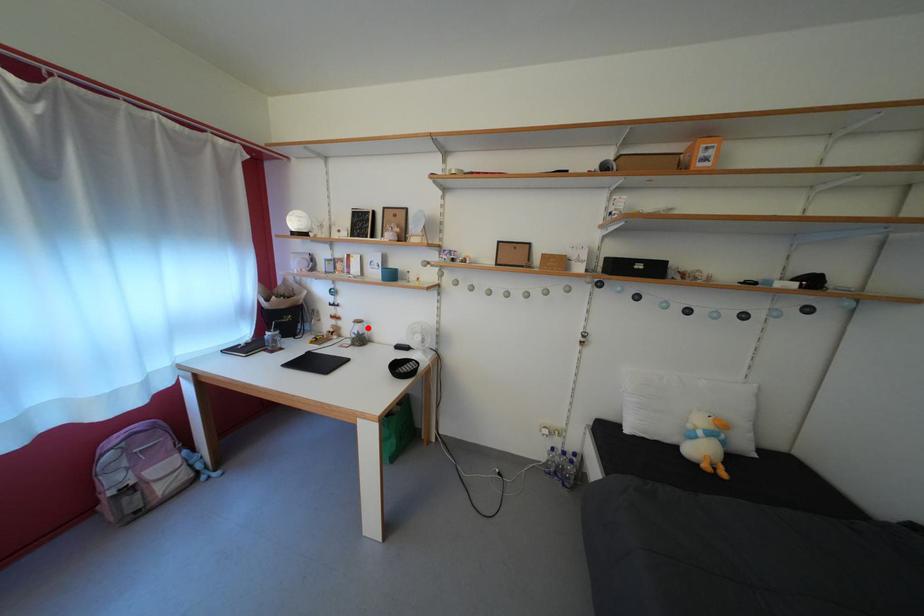
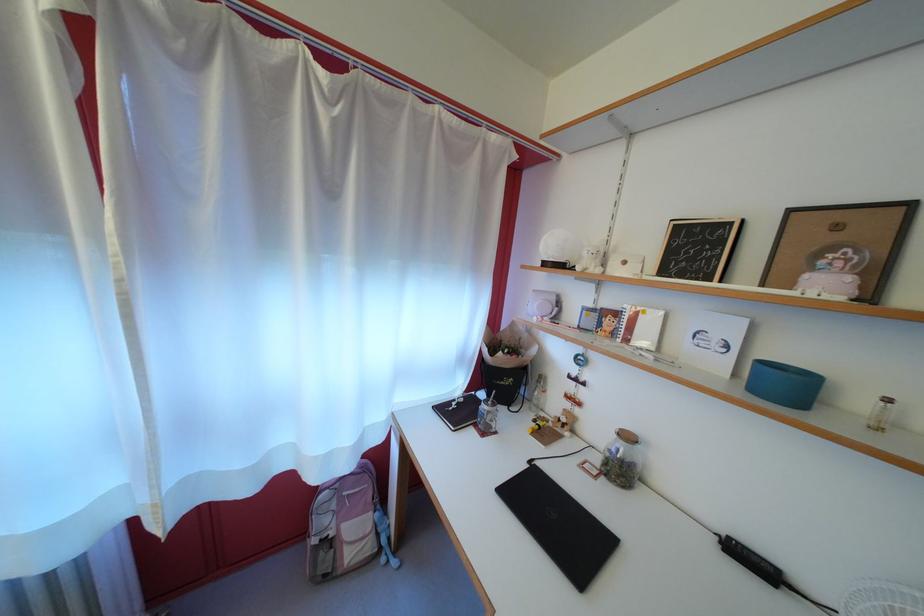
The point at the highlighted location is marked in the first image. Where is the corresponding point in the second image?

(637, 444)